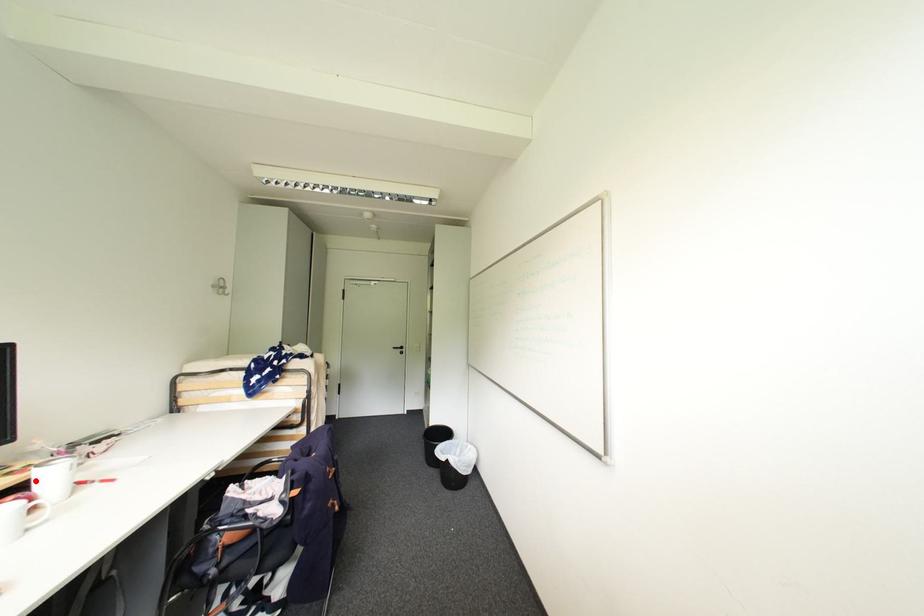
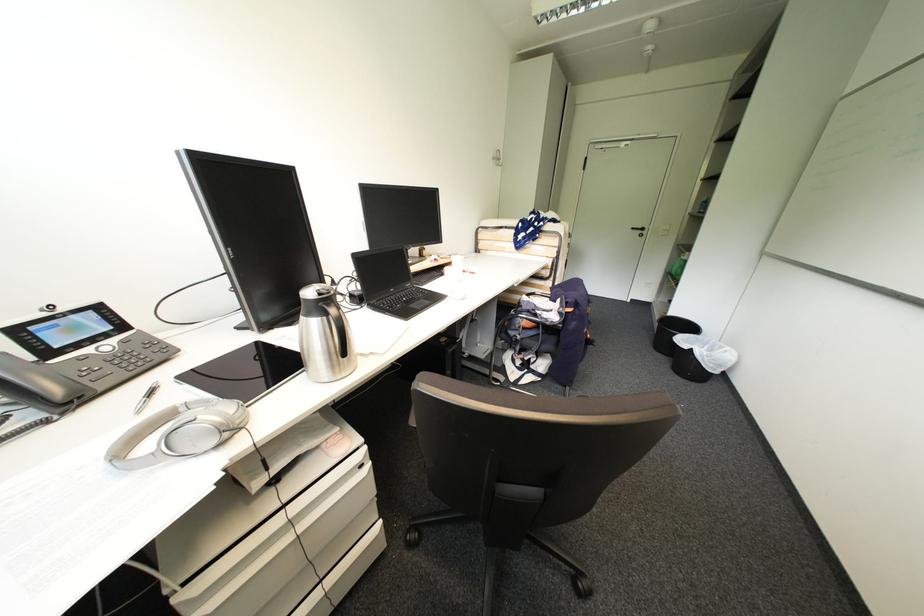
Locate, in the second image, the point that corresponds to the highlighted location in the first image.

(456, 262)